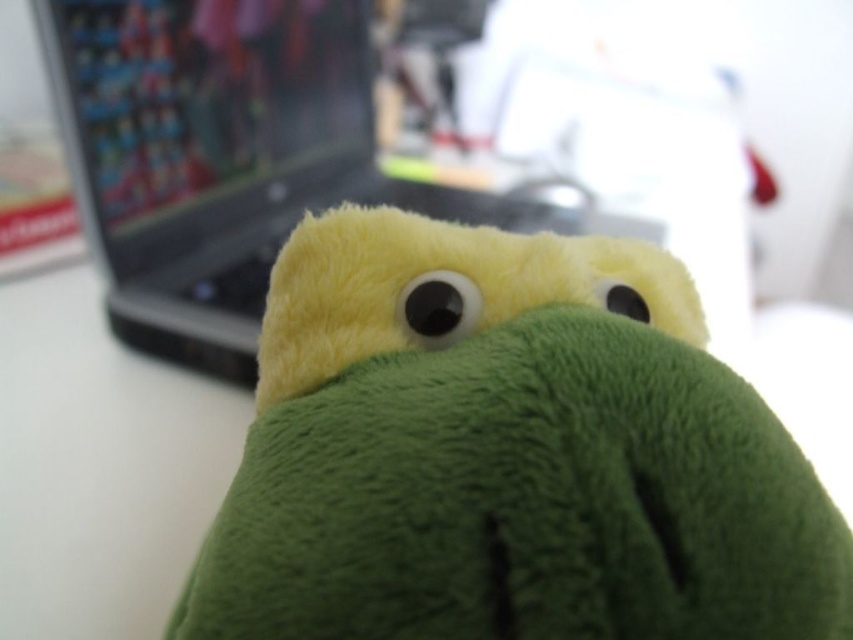
Is green fuzzy plush toy at center taller than silver metallic laptop at center?

Incorrect, green fuzzy plush toy at center's height is not larger of silver metallic laptop at center's.

Which of these two, green fuzzy plush toy at center or silver metallic laptop at center, stands taller?

With more height is silver metallic laptop at center.

Who is more forward, (509, 435) or (419, 189)?

Point (509, 435) is in front.

Image resolution: width=853 pixels, height=640 pixels. Identify the location of green fuzzy plush toy at center. coord(506,452).